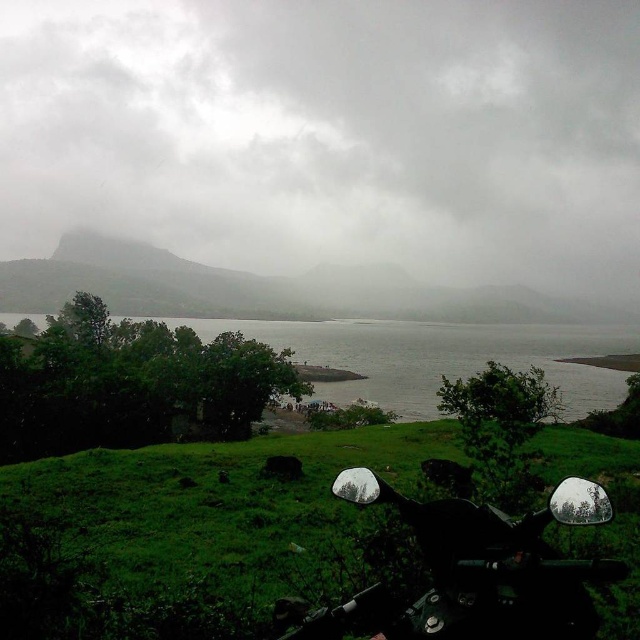
You are a hiker standing on the green grassy at lower center and want to reach the green matte mountain at upper left. Which direction should you move to get closer to the mountain?

You should move towards the upper left direction to get closer to the green matte mountain at upper left as it is positioned above the green grassy at lower center.

You are a hiker planning to take a photo of the green matte mountain at upper left and the cloudy fog at upper center. Based on the scene, which object is positioned higher in the image?

The cloudy fog at upper center is positioned higher than the green matte mountain at upper left in the image.

You are planning to set up a tent for a camping trip. You have two options for the location based on the scene you see. The first option is on the green grassy at lower center and the second is near the green matte mountain at upper left. Which location would give you more space to set up your tent?

The green matte mountain at upper left occupies more space than the green grassy at lower center, so setting up the tent near the green matte mountain at upper left would provide more space.